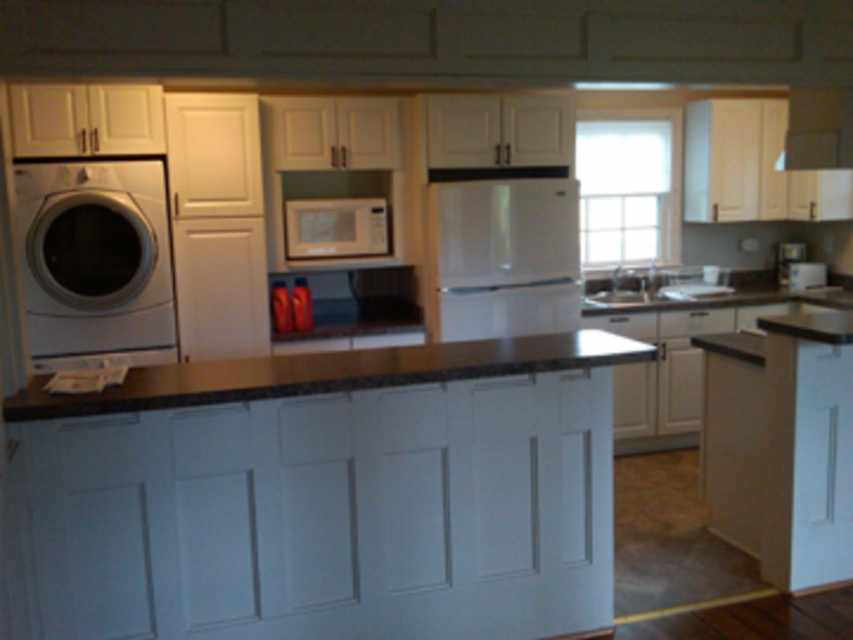
Question: Which of the following is the farthest from the observer?

Choices:
 (A) white glossy sink at center
 (B) white glossy sink at center right
 (C) black granite countertop at center
 (D) white glossy washing machine at left

Answer: (B)

Question: Does satin white refrigerator at center come in front of satin gold microwave at center?

Choices:
 (A) no
 (B) yes

Answer: (B)

Question: Among these points, which one is nearest to the camera?

Choices:
 (A) (294, 259)
 (B) (537, 314)

Answer: (A)

Question: Is the position of white glossy washing machine at left less distant than that of satin gold microwave at center?

Choices:
 (A) yes
 (B) no

Answer: (A)

Question: Is black granite countertop at center to the left of white glossy sink at center right from the viewer's perspective?

Choices:
 (A) no
 (B) yes

Answer: (B)

Question: Which point is closer to the camera?

Choices:
 (A) white glossy sink at center right
 (B) white glossy sink at center
 (C) white glossy washing machine at left

Answer: (C)